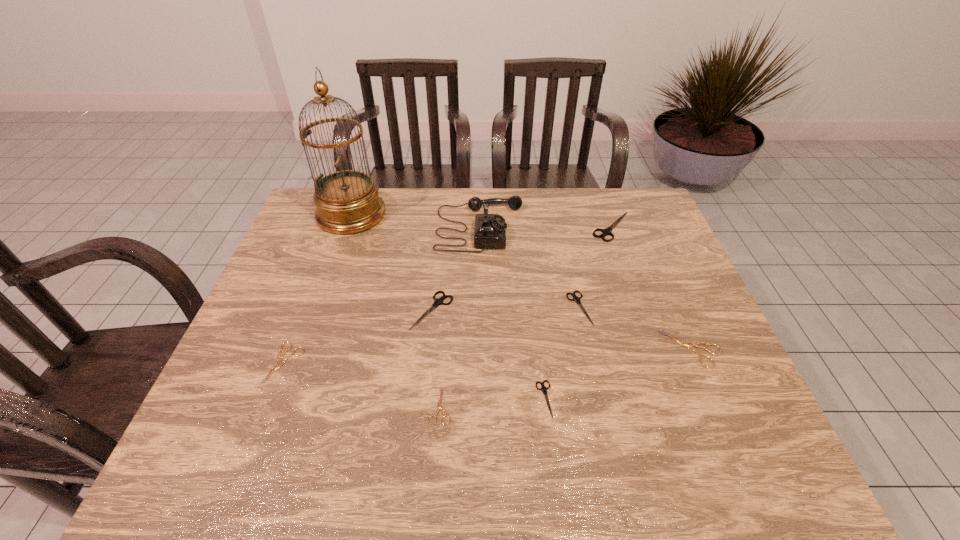
The image size is (960, 540). Find the location of `golden birdcage`. golden birdcage is located at coordinates (347, 201).

Find the location of `the tallest object`. the tallest object is located at coordinates (347, 201).

Find the location of a particular element. the eighth shortest object is located at coordinates (489, 229).

Identify the location of the rightmost black shears. The width and height of the screenshot is (960, 540). (607, 231).

At what (x,y) coordinates should I click in order to perform the action: click on the farthest black shears. Please return your answer as a coordinate pair (x, y). Image resolution: width=960 pixels, height=540 pixels. Looking at the image, I should click on (607, 231).

Find the location of `the sixth shortest object`. the sixth shortest object is located at coordinates (439, 301).

This screenshot has height=540, width=960. In order to click on the sixth shortest shears in this screenshot , I will do `click(439, 301)`.

Find the location of a particular element. the third object from right to left is located at coordinates (577, 299).

The image size is (960, 540). I want to click on the third shears from right to left, so click(577, 299).

Identify the location of the rightmost beige shears. Image resolution: width=960 pixels, height=540 pixels. (688, 345).